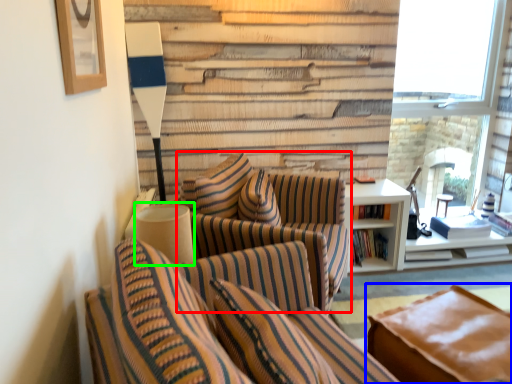
Question: Which is nearer to the chair (highlighted by a red box)? studio couch (highlighted by a blue box) or table lamp (highlighted by a green box).

Choices:
 (A) studio couch
 (B) table lamp

Answer: (B)